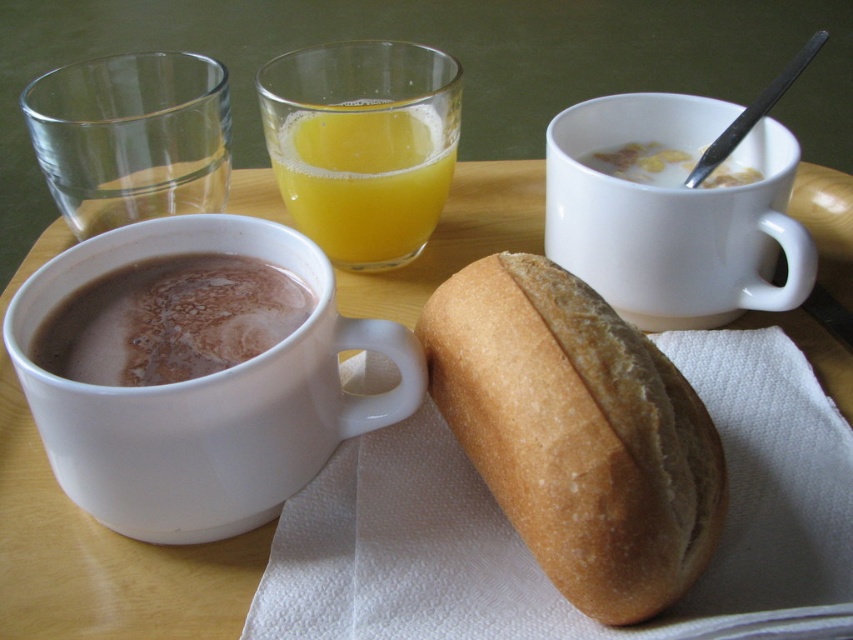
Is point (194, 483) closer to camera compared to point (170, 268)?

Yes, point (194, 483) is in front of point (170, 268).

The image size is (853, 640). What do you see at coordinates (204, 396) in the screenshot? I see `white glossy mug at left` at bounding box center [204, 396].

This screenshot has height=640, width=853. I want to click on white glossy mug at left, so click(204, 396).

Does golden brown crusty bread at center come behind white glossy mug at upper center?

No, golden brown crusty bread at center is closer to the viewer.

Between golden brown crusty bread at center and white glossy mug at upper center, which one appears on the right side from the viewer's perspective?

Positioned to the right is white glossy mug at upper center.

Locate an element on the screen. The width and height of the screenshot is (853, 640). golden brown crusty bread at center is located at coordinates (576, 433).

Is white glossy mug at left positioned before white glossy mug at upper center?

Yes, white glossy mug at left is in front of white glossy mug at upper center.

Who is shorter, white glossy mug at left or white glossy mug at upper center?

white glossy mug at upper center is shorter.

Image resolution: width=853 pixels, height=640 pixels. Identify the location of white glossy mug at left. (204, 396).